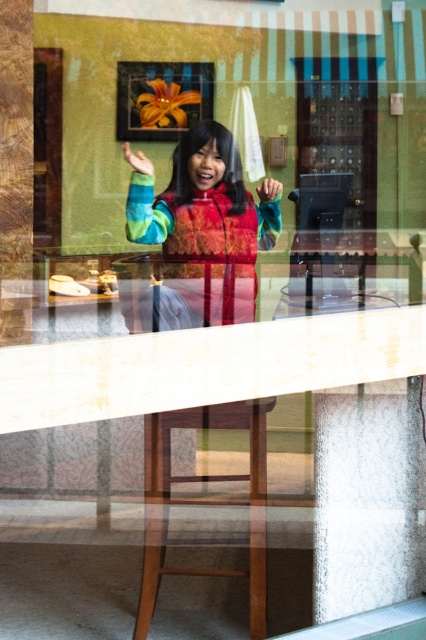
Question: Based on their relative distances, which object is farther from the transparent glass door at center?

Choices:
 (A) green matte hand at center
 (B) multicolored fleece jacket at center

Answer: (A)

Question: Is transparent glass door at center in front of brown wooden stool at lower center?

Choices:
 (A) yes
 (B) no

Answer: (B)

Question: Where is transparent glass door at center located in relation to brown wooden stool at lower center in the image?

Choices:
 (A) right
 (B) left

Answer: (A)

Question: Considering the real-world distances, which object is farthest from the transparent glass door at center?

Choices:
 (A) green matte hand at center
 (B) brown wooden stool at lower center

Answer: (B)

Question: Is multicolored fleece jacket at center above green matte hand at center?

Choices:
 (A) yes
 (B) no

Answer: (B)

Question: Among these objects, which one is nearest to the camera?

Choices:
 (A) transparent glass door at center
 (B) green matte hand at center
 (C) multicolored fleece jacket at center
 (D) brown wooden stool at lower center

Answer: (D)